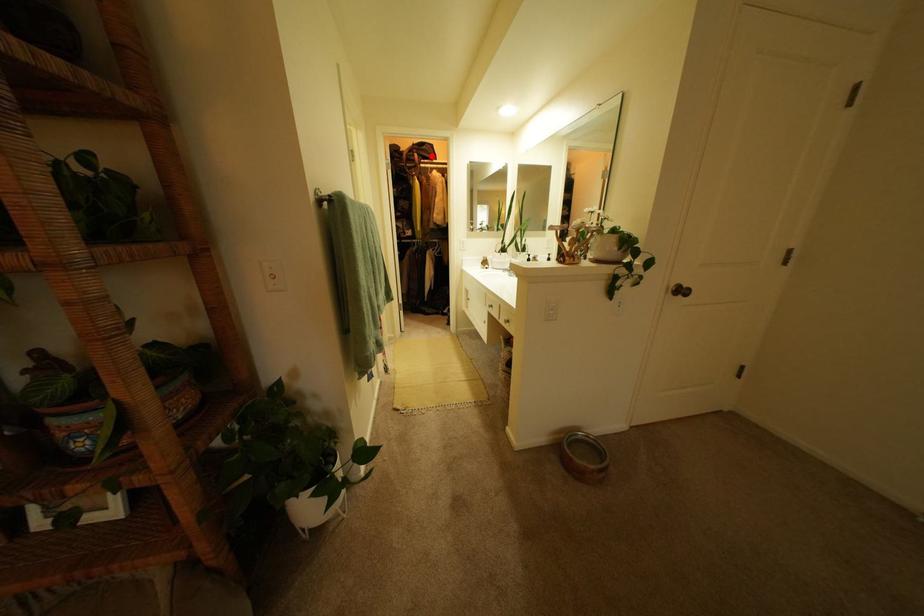
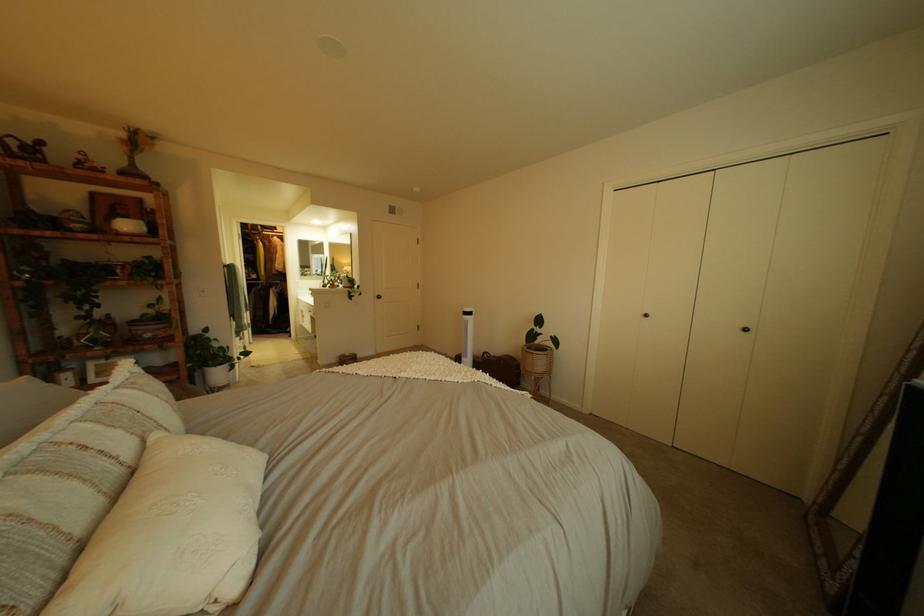
In the second image, find the point that corresponds to the highlighted location in the first image.

(274, 228)